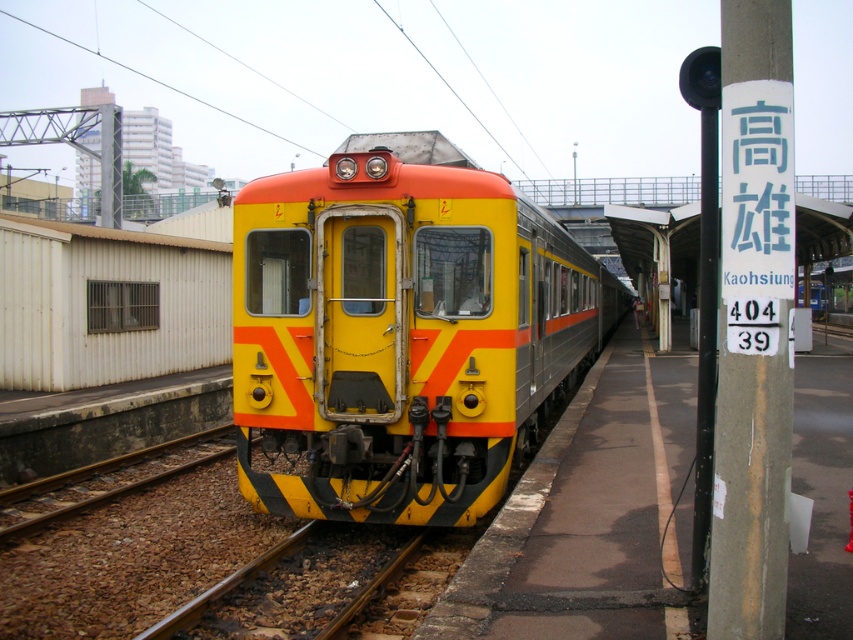
In the scene shown: Can you confirm if yellow matte train at center is thinner than brown gravel at lower left?

No, yellow matte train at center is not thinner than brown gravel at lower left.

Which is more to the left, yellow matte train at center or brown gravel at lower left?

Positioned to the left is brown gravel at lower left.

Describe the element at coordinates (402, 333) in the screenshot. This screenshot has height=640, width=853. I see `yellow matte train at center` at that location.

At what (x,y) coordinates should I click in order to perform the action: click on yellow matte train at center. Please return your answer as a coordinate pair (x, y). This screenshot has height=640, width=853. Looking at the image, I should click on (402, 333).